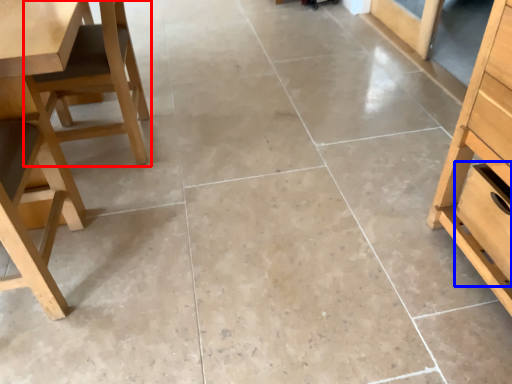
Question: Which object appears farthest to the camera in this image, chair (highlighted by a red box) or drawer (highlighted by a blue box)?

Choices:
 (A) chair
 (B) drawer

Answer: (A)